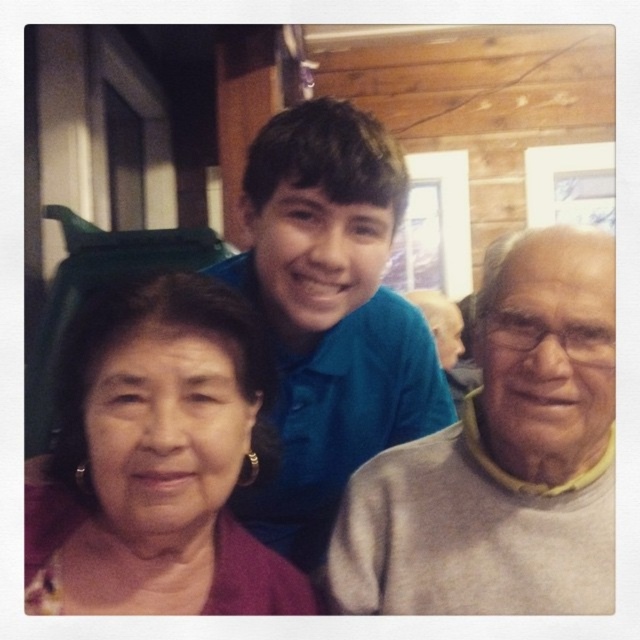
Based on the photo, in the scene described, there is a purple fabric at left and a blue cotton shirt at center. From the perspective of someone standing in front of the group, which object is closer to you?

The purple fabric at left is closer because it is in front of the blue cotton shirt at center.